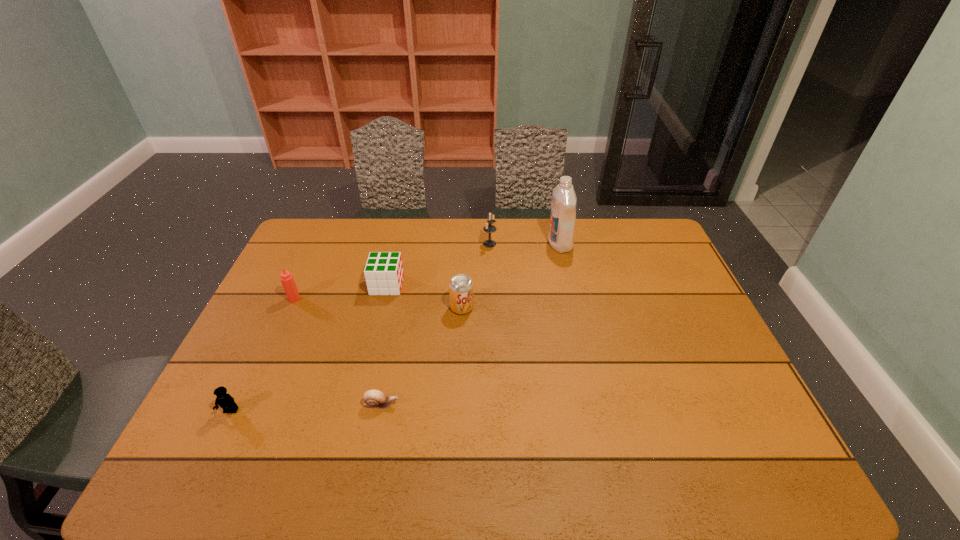
The width and height of the screenshot is (960, 540). Find the location of `vacant area at the near edge`. vacant area at the near edge is located at coordinates (588, 448).

Locate an element on the screen. free space at the left edge is located at coordinates (199, 432).

Where is `free space at the right edge of the desktop`? This screenshot has height=540, width=960. free space at the right edge of the desktop is located at coordinates (679, 317).

Identify the location of vacant space at the far left corner of the desktop. Image resolution: width=960 pixels, height=540 pixels. (319, 225).

Locate an element on the screen. Image resolution: width=960 pixels, height=540 pixels. vacant region at the far right corner of the desktop is located at coordinates (635, 233).

Identify the location of free space between the escargot and the Tabasco sauce. This screenshot has width=960, height=540. (338, 352).

The image size is (960, 540). I want to click on vacant space in between the second object from right to left and the fifth object from left to right, so click(x=475, y=275).

Where is `blank region between the cube and the second shortest object`? The image size is (960, 540). blank region between the cube and the second shortest object is located at coordinates (309, 348).

Find the location of a particular element. This screenshot has height=540, width=960. free space between the second object from right to left and the pop (soda) is located at coordinates (475, 275).

The width and height of the screenshot is (960, 540). What are the coordinates of `free space between the cube and the escargot` in the screenshot? It's located at (384, 345).